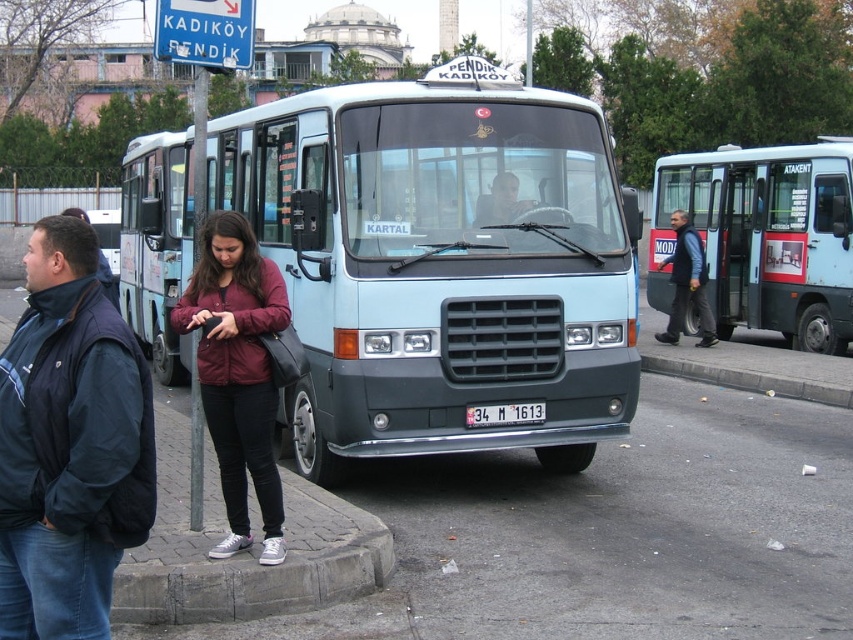
You are a fashion designer observing the pedestrians in the scene. You notice two jackets, the dark blue jacket at left and the maroon fabric jacket at center. Which jacket appears shorter in length?

The dark blue jacket at left has a lesser height compared to maroon fabric jacket at center, so the dark blue jacket at left appears shorter in length.

You are a delivery person who needs to park your 2.5 meters tall delivery van behind the gray concrete curb at lower right. You see the light blue metallic bus at center parked there. Can you safely park your van without hitting the curb?

The light blue metallic bus at center is taller than the gray concrete curb at lower right. Since the bus is already parked there and it is taller than the curb, your van at 2.5 meters may also fit, but you need to ensure the curb height is lower than your van. However, since the bus is taller, the curb height is under the bus height. Without exact measurements, it is uncertain. Consider checking the curb height before parking.